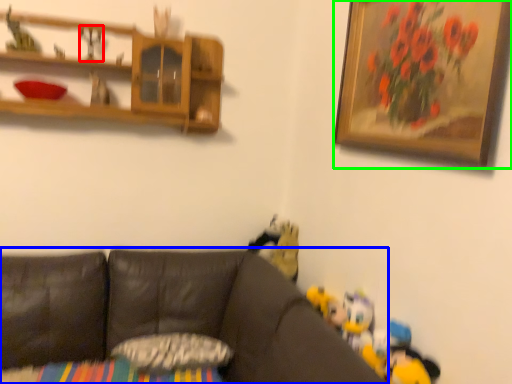
Question: Estimate the real-world distances between objects in this image. Which object is farther from toy (highlighted by a red box), studio couch (highlighted by a blue box) or picture frame (highlighted by a green box)?

Choices:
 (A) studio couch
 (B) picture frame

Answer: (B)